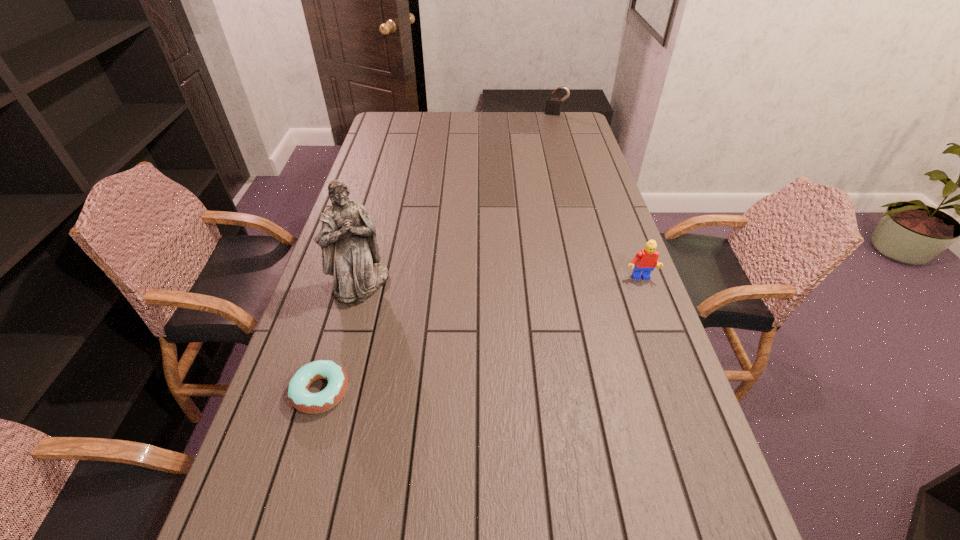
Where is `vacant area that lies between the figurine and the nearest object`? The width and height of the screenshot is (960, 540). vacant area that lies between the figurine and the nearest object is located at coordinates (341, 338).

The width and height of the screenshot is (960, 540). I want to click on free spot between the figurine and the nearest object, so click(x=341, y=338).

Identify the location of empty location between the figurine and the second object from right to left. The width and height of the screenshot is (960, 540). (459, 199).

This screenshot has height=540, width=960. Find the location of `free space between the farthest object and the tallest object`. free space between the farthest object and the tallest object is located at coordinates (459, 199).

Locate an element on the screen. free space between the Lego and the nearest object is located at coordinates (480, 335).

Find the location of a particular element. This screenshot has height=540, width=960. free spot between the nearest object and the figurine is located at coordinates (341, 338).

Choose which object is the third nearest neighbor to the farthest object. Please provide its 2D coordinates. Your answer should be formatted as a tuple, i.e. [(x, y)], where the tuple contains the x and y coordinates of a point satisfying the conditions above.

[(299, 396)]

Identify which object is the second closest to the second object from right to left. Please provide its 2D coordinates. Your answer should be formatted as a tuple, i.e. [(x, y)], where the tuple contains the x and y coordinates of a point satisfying the conditions above.

[(350, 253)]

What are the coordinates of `free spot that satisfies the following two spatial constraints: 1. on the back side of the figurine; 2. on the right side of the farthest object` in the screenshot? It's located at (408, 114).

The image size is (960, 540). What are the coordinates of `vacant space that satisfies the following two spatial constraints: 1. on the back side of the figurine; 2. on the right side of the farthest object` in the screenshot? It's located at (408, 114).